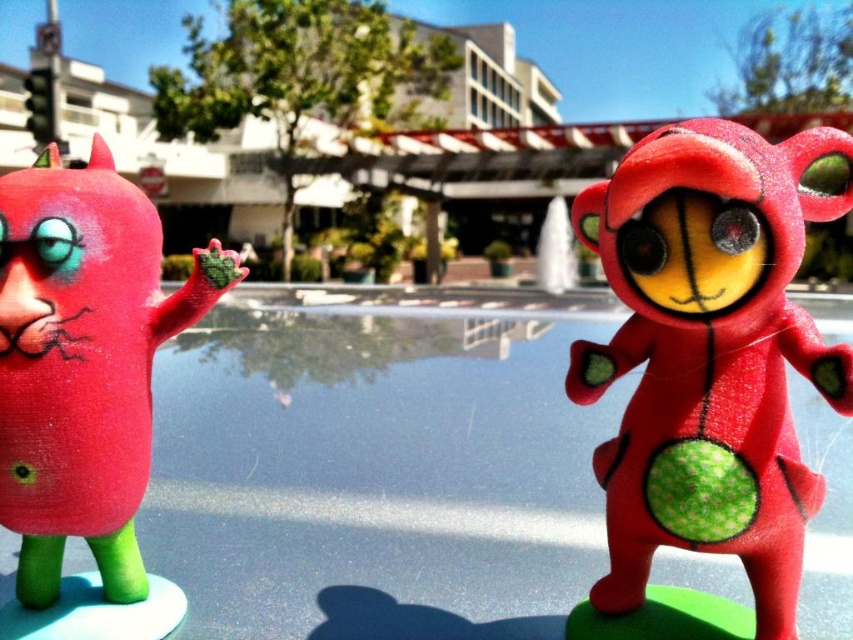
Looking at this image, who is lower down, matte red plush toy at right or matte red toy at left?

matte red plush toy at right

Which is above, matte red plush toy at right or matte red toy at left?

matte red toy at left

Between point (747, 364) and point (210, 280), which one is positioned behind?

The point (210, 280) is behind.

Image resolution: width=853 pixels, height=640 pixels. Identify the location of matte red plush toy at right. (711, 352).

Between point (155, 552) and point (21, 300), which one is positioned behind?

The point (155, 552) is more distant.

Does point (381, 497) lie in front of point (64, 426)?

No, (381, 497) is further to viewer.

Does point (358, 353) come farther from viewer compared to point (195, 269)?

That is True.

The height and width of the screenshot is (640, 853). I want to click on transparent glass pool at center, so click(x=378, y=465).

Is point (465, 582) farther from viewer compared to point (761, 468)?

Yes, it is.

Is point (558, 636) less distant than point (625, 208)?

That is False.

I want to click on transparent glass pool at center, so click(x=378, y=465).